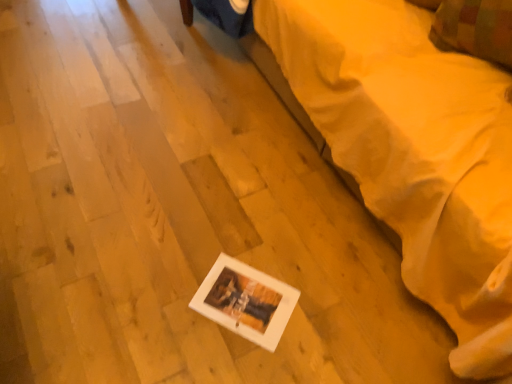
Question: Is plaid fabric pillow at upper right aimed at white matte picture frame at lower center?

Choices:
 (A) no
 (B) yes

Answer: (B)

Question: Does plaid fabric pillow at upper right have a greater height compared to white matte picture frame at lower center?

Choices:
 (A) no
 (B) yes

Answer: (A)

Question: Considering the relative sizes of plaid fabric pillow at upper right and white matte picture frame at lower center in the image provided, is plaid fabric pillow at upper right thinner than white matte picture frame at lower center?

Choices:
 (A) yes
 (B) no

Answer: (A)

Question: Does plaid fabric pillow at upper right appear on the left side of white matte picture frame at lower center?

Choices:
 (A) no
 (B) yes

Answer: (A)

Question: From a real-world perspective, does plaid fabric pillow at upper right stand above white matte picture frame at lower center?

Choices:
 (A) yes
 (B) no

Answer: (A)

Question: From the image's perspective, would you say plaid fabric pillow at upper right is positioned over white matte picture frame at lower center?

Choices:
 (A) yes
 (B) no

Answer: (A)

Question: Is white matte picture frame at lower center closer to camera compared to plaid fabric pillow at upper right?

Choices:
 (A) yes
 (B) no

Answer: (A)

Question: From a real-world perspective, is white matte picture frame at lower center beneath plaid fabric pillow at upper right?

Choices:
 (A) no
 (B) yes

Answer: (B)

Question: From the image's perspective, is white matte picture frame at lower center on top of plaid fabric pillow at upper right?

Choices:
 (A) yes
 (B) no

Answer: (B)

Question: Is white matte picture frame at lower center further to camera compared to plaid fabric pillow at upper right?

Choices:
 (A) yes
 (B) no

Answer: (B)

Question: Is white matte picture frame at lower center bigger than plaid fabric pillow at upper right?

Choices:
 (A) yes
 (B) no

Answer: (A)

Question: Does white matte picture frame at lower center have a lesser width compared to plaid fabric pillow at upper right?

Choices:
 (A) no
 (B) yes

Answer: (A)

Question: Which is correct: plaid fabric pillow at upper right is inside white matte picture frame at lower center, or outside of it?

Choices:
 (A) inside
 (B) outside

Answer: (A)